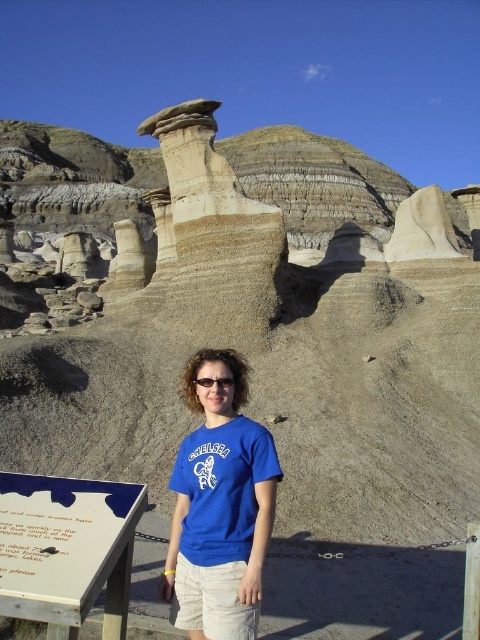
Question: Which point appears farthest from the camera in this image?

Choices:
 (A) (225, 380)
 (B) (242, 429)
 (C) (27, 604)

Answer: (A)

Question: Is blue cotton t-shirt at center below transparent plastic goggles at center?

Choices:
 (A) no
 (B) yes

Answer: (B)

Question: Which of the following is the farthest from the observer?

Choices:
 (A) (275, 461)
 (B) (228, 385)
 (C) (52, 596)

Answer: (B)

Question: Can you confirm if white wood sign at lower left is smaller than transparent plastic goggles at center?

Choices:
 (A) yes
 (B) no

Answer: (A)

Question: Estimate the real-world distances between objects in this image. Which object is closer to the transparent plastic goggles at center?

Choices:
 (A) white wood sign at lower left
 (B) blue cotton t-shirt at center

Answer: (B)

Question: Considering the relative positions of blue cotton t-shirt at center and white wood sign at lower left in the image provided, where is blue cotton t-shirt at center located with respect to white wood sign at lower left?

Choices:
 (A) below
 (B) above

Answer: (B)